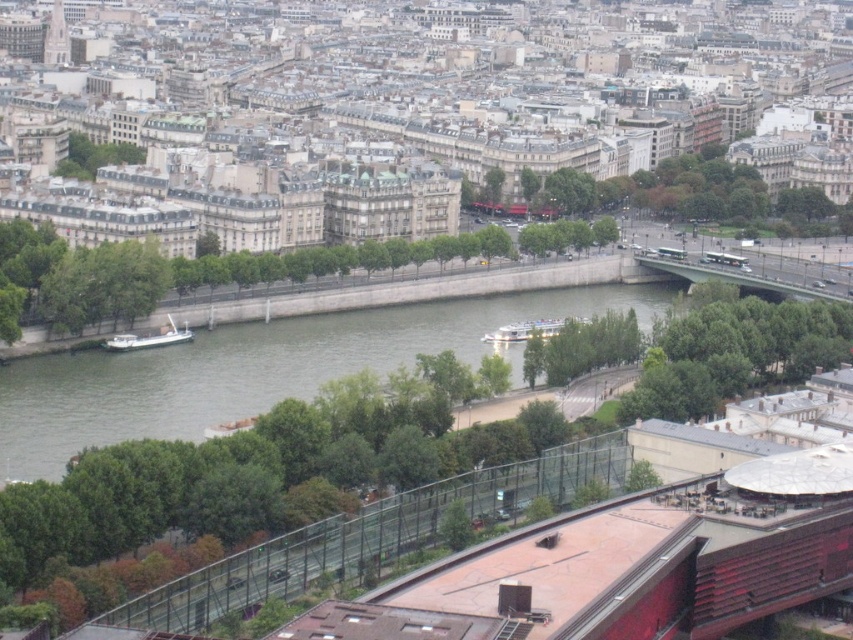
Does green water at center appear under brushed metal eiffel tower at upper left?

Yes.

Which is below, green water at center or brushed metal eiffel tower at upper left?

Positioned lower is green water at center.

What do you see at coordinates (258, 369) in the screenshot? The height and width of the screenshot is (640, 853). I see `green water at center` at bounding box center [258, 369].

Where is `green water at center`? green water at center is located at coordinates (258, 369).